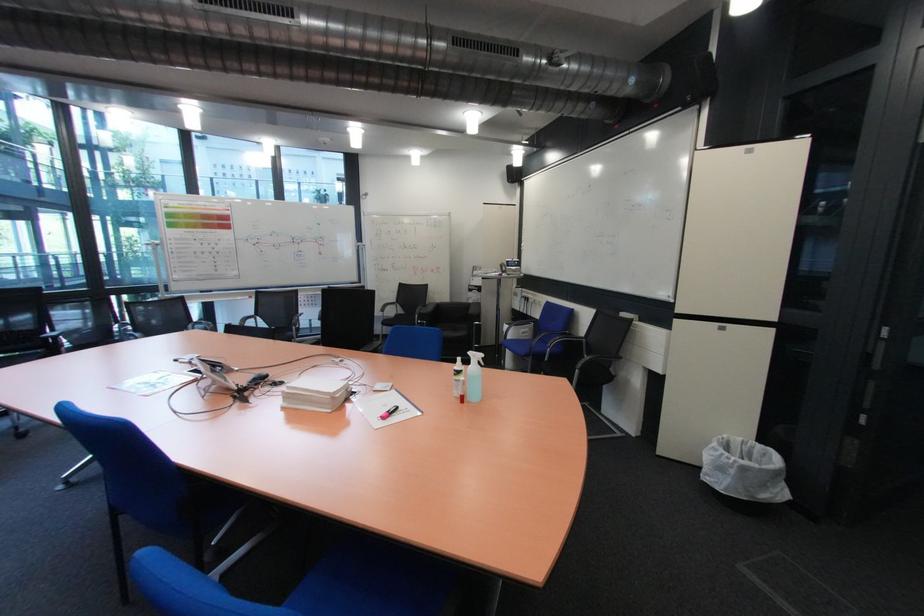
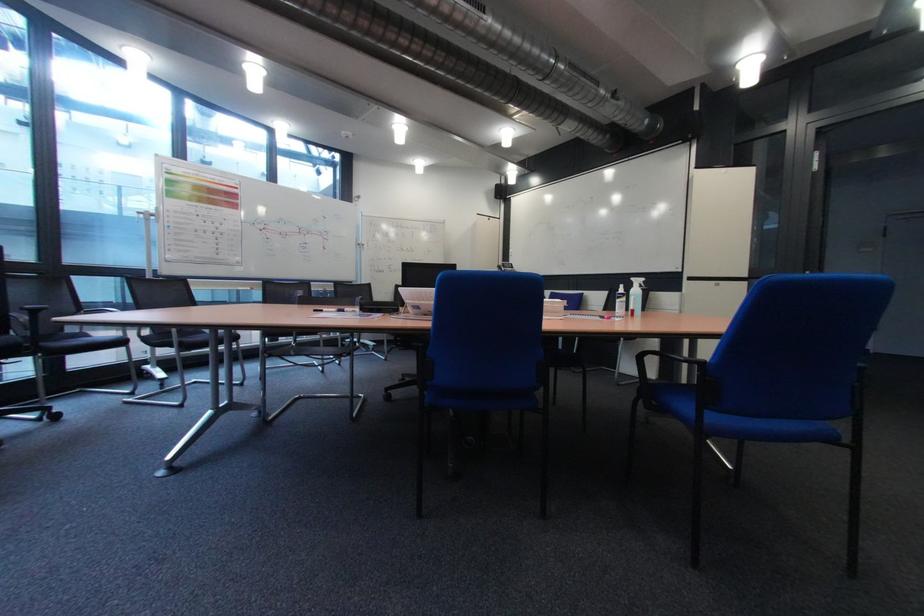
Question: What movement of the cameraman would produce the second image?

Choices:
 (A) Left
 (B) Right
 (C) Forward
 (D) Backward

Answer: (A)